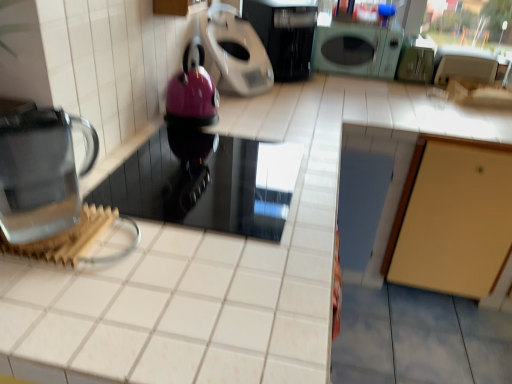
Question: Is metallic silver scale at upper center, positioned as the 1th kitchen appliance in left-to-right order, spatially inside transparent glass kettle at left, or outside of it?

Choices:
 (A) outside
 (B) inside

Answer: (A)

Question: In terms of width, does metallic silver scale at upper center, positioned as the 1th kitchen appliance in left-to-right order, look wider or thinner when compared to transparent glass kettle at left?

Choices:
 (A) wide
 (B) thin

Answer: (A)

Question: Which object is the closest to the black glossy microwave at upper center, arranged as the second kitchen appliance when viewed from the left?

Choices:
 (A) transparent glass kettle at left
 (B) glossy plastic kettle at upper center, the second appliance when ordered from bottom to top
 (C) glossy black microwave at center, the first appliance positioned from the bottom
 (D) metallic silver scale at upper center, positioned as the 1th kitchen appliance in left-to-right order

Answer: (D)

Question: Which of these objects is positioned closest to the glossy plastic kettle at upper center, positioned as the 1th appliance in top-to-bottom order?

Choices:
 (A) glossy black microwave at center, acting as the second appliance starting from the top
 (B) metallic silver scale at upper center, positioned as the 1th kitchen appliance in left-to-right order
 (C) transparent glass kettle at left
 (D) black glossy microwave at upper center, arranged as the second kitchen appliance when viewed from the left

Answer: (B)